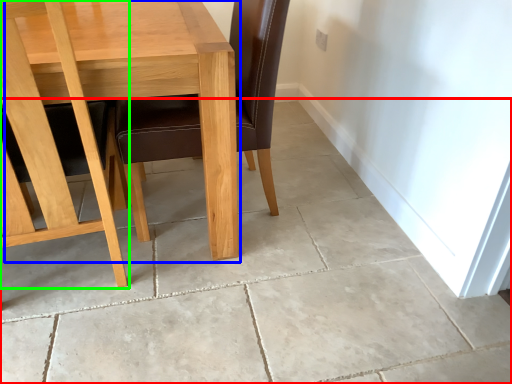
Question: Which object is the closest to the concrete (highlighted by a red box)? Choose among these: table (highlighted by a blue box) or chair (highlighted by a green box).

Choices:
 (A) table
 (B) chair

Answer: (B)